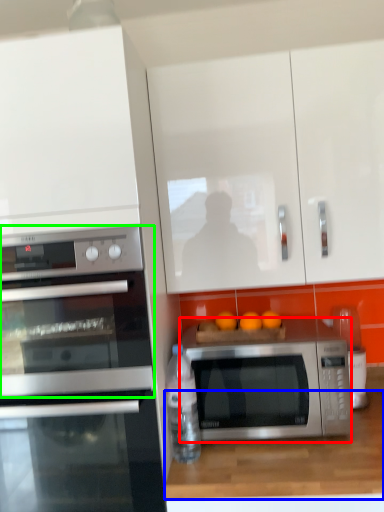
Question: Which object is positioned closest to microwave oven (highlighted by a red box)? Select from counter top (highlighted by a blue box) and microwave oven (highlighted by a green box).

Choices:
 (A) counter top
 (B) microwave oven

Answer: (A)